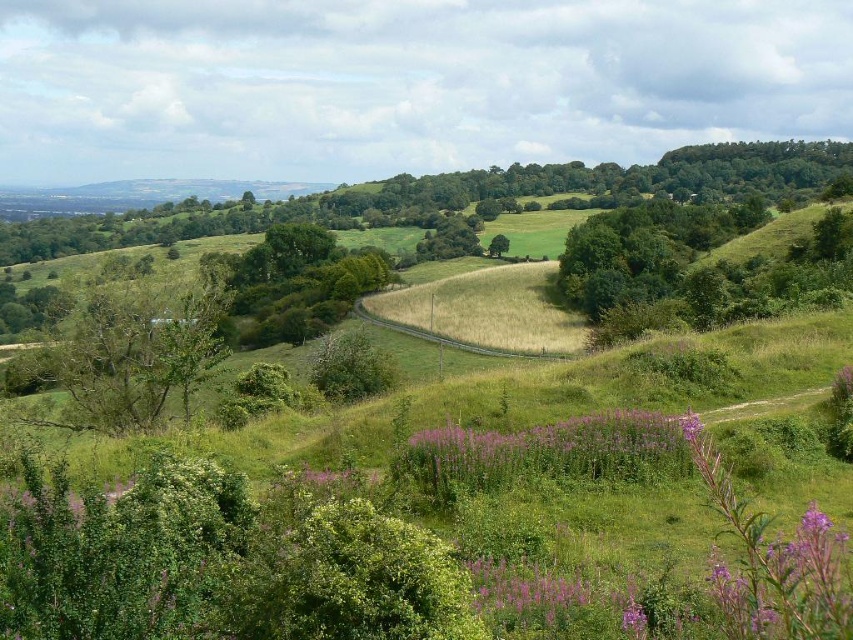
Between green leafy tree at left and purple soft grass at center, which one has more height?

Standing taller between the two is purple soft grass at center.

Does green leafy tree at left have a larger size compared to purple soft grass at center?

No, green leafy tree at left is not bigger than purple soft grass at center.

Does point (94, 392) come closer to viewer compared to point (625, 449)?

No, it is not.

Identify the location of green leafy tree at left. (140, 355).

Between green leafy tree at left and green leafy tree at center, which one has more height?

green leafy tree at center

Is green leafy tree at left closer to the viewer compared to green leafy tree at center?

Yes, green leafy tree at left is closer to the viewer.

Find the location of a particular element. green leafy tree at left is located at coordinates (140, 355).

Find the location of `green leafy tree at left`. green leafy tree at left is located at coordinates [140, 355].

Is purple soft grass at center in front of green leafy tree at center?

Yes, purple soft grass at center is in front of green leafy tree at center.

Between point (428, 474) and point (498, 256), which one is positioned in front?

Point (428, 474) is in front.

Describe the element at coordinates (547, 449) in the screenshot. I see `purple soft grass at center` at that location.

Locate an element on the screen. purple soft grass at center is located at coordinates (547, 449).